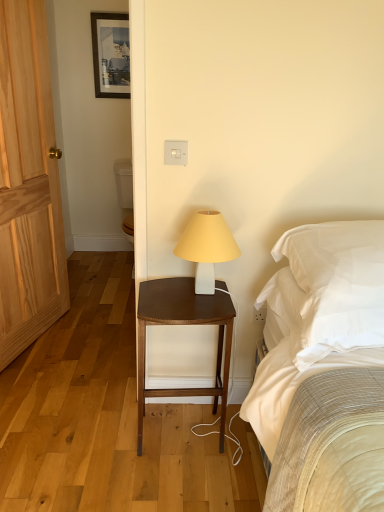
Find the location of a particular element. The height and width of the screenshot is (512, 384). free point above brown wood nightstand at center (from a real-world perspective) is located at coordinates (187, 294).